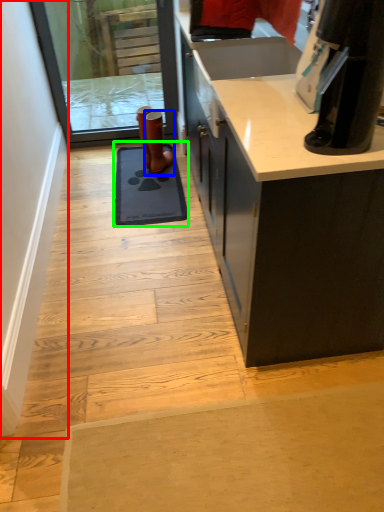
Question: Which object is the farthest from door (highlighted by a red box)? Choose among these: footwear (highlighted by a blue box) or doormat (highlighted by a green box).

Choices:
 (A) footwear
 (B) doormat

Answer: (A)